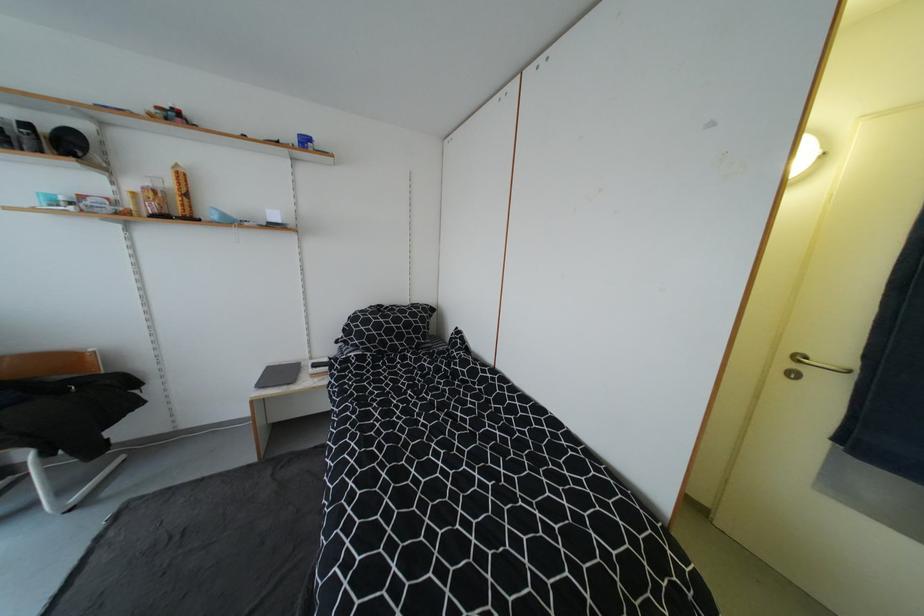
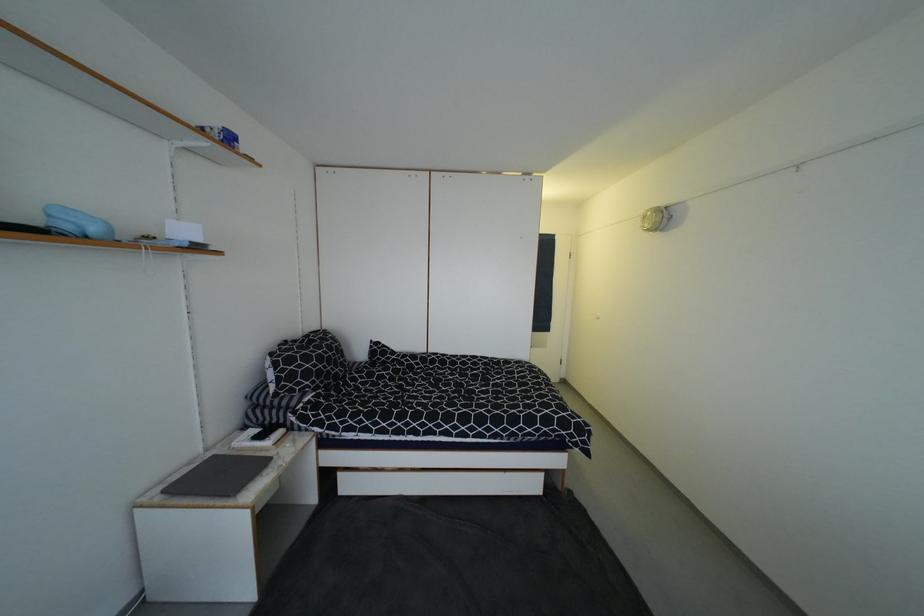
In the second image, find the point that corresponds to point (362, 328) in the first image.

(305, 368)